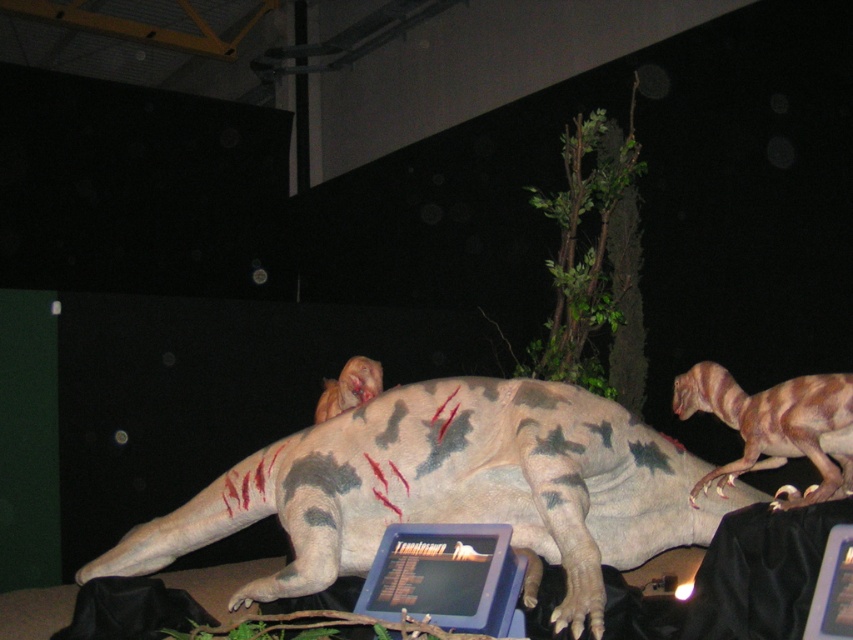
From the picture: Between camouflage-patterned dinosaur at center and blue plastic laptop at center, which one is positioned higher?

blue plastic laptop at center is higher up.

How distant is camouflage-patterned dinosaur at center from blue plastic laptop at center?

The distance of camouflage-patterned dinosaur at center from blue plastic laptop at center is 16.46 inches.

Which is behind, point (521, 448) or point (496, 612)?

Positioned behind is point (521, 448).

The width and height of the screenshot is (853, 640). Find the location of `camouflage-patterned dinosaur at center`. camouflage-patterned dinosaur at center is located at coordinates (453, 490).

Does camouflage-patterned dinosaur at center have a lesser width compared to brown textured dinosaur head at center?

No, camouflage-patterned dinosaur at center is not thinner than brown textured dinosaur head at center.

Is point (422, 493) behind point (328, 392)?

No, (422, 493) is closer to viewer.

Which is in front, point (535, 483) or point (326, 392)?

Point (535, 483) is more forward.

Locate an element on the screen. This screenshot has width=853, height=640. camouflage-patterned dinosaur at center is located at coordinates (453, 490).

Which is in front, point (722, 392) or point (380, 385)?

Point (722, 392) is more forward.

Is brown textured dinosaur at right positioned at the back of brown textured dinosaur head at center?

No, it is not.

Does point (706, 408) lie behind point (343, 394)?

No.

Where is `brown textured dinosaur at right`? brown textured dinosaur at right is located at coordinates (775, 426).